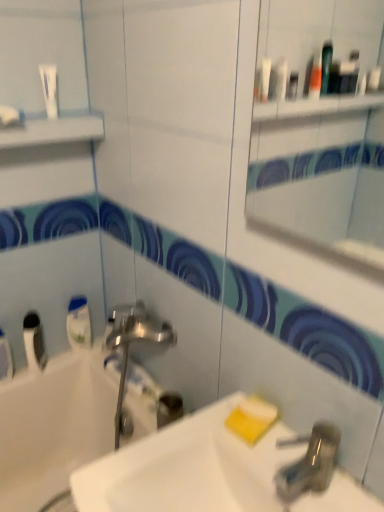
The image size is (384, 512). Identify the location of free area in between yellow sponge at lower center, which is the 2th soap from top to bottom, and metallic faucet at lower right. (266, 453).